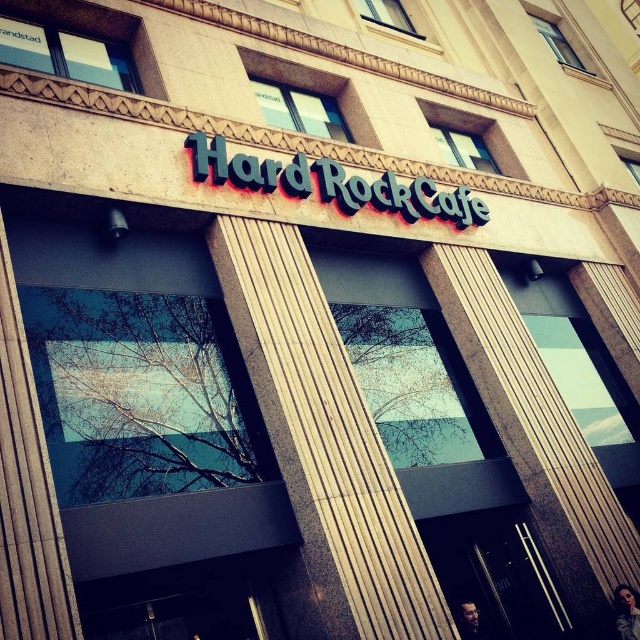
Can you confirm if wooden pillar at center is positioned below blue metallic sign at center?

Yes, wooden pillar at center is below blue metallic sign at center.

From the picture: Is wooden pillar at center smaller than blue metallic sign at center?

Actually, wooden pillar at center might be larger than blue metallic sign at center.

This screenshot has width=640, height=640. I want to click on wooden pillar at center, so click(324, 440).